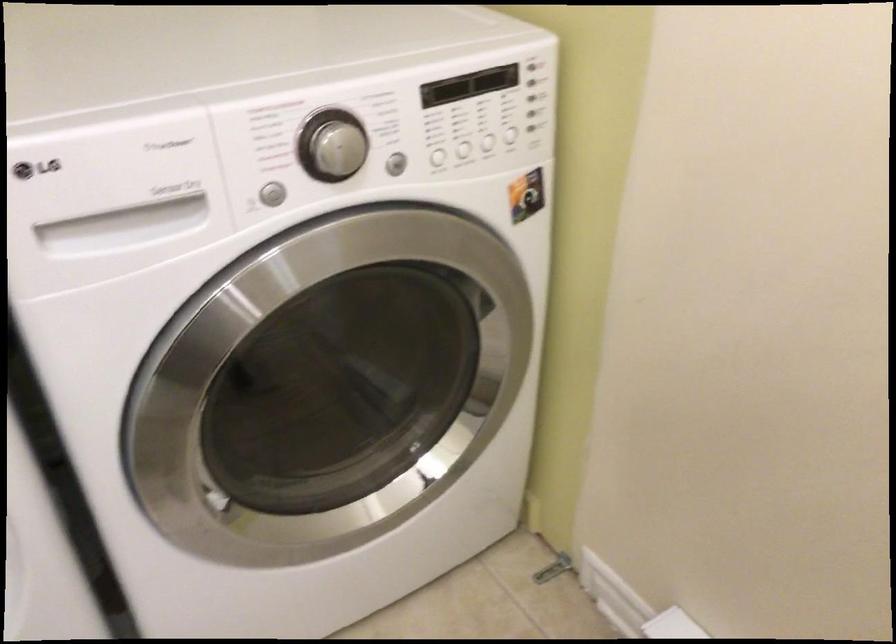
Find where to pull the dispenser drawer handle. Please return your answer as a coordinate pair (x, y).

(164, 210)